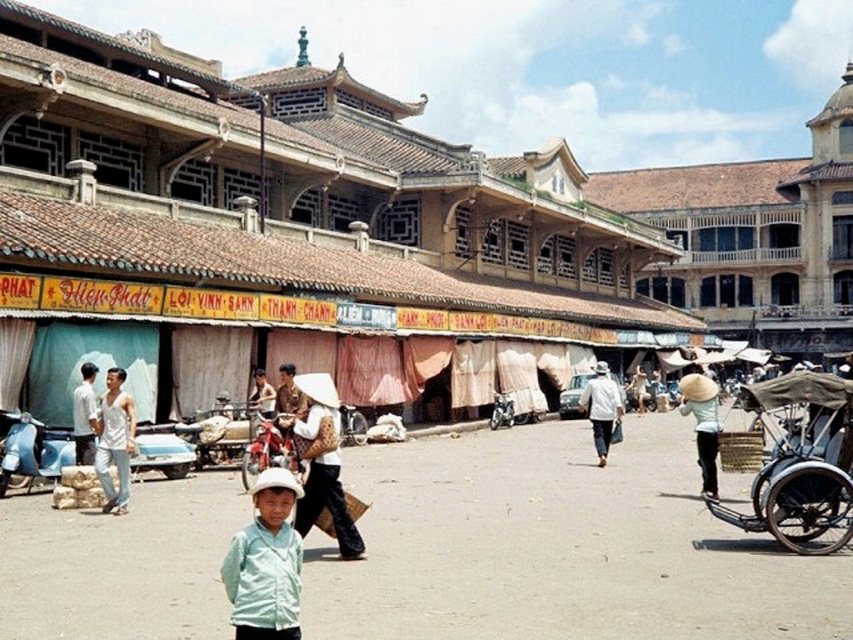
You are a vendor at this market and need to decide which item to place on a narrow shelf that can only hold items thinner than 10 cm. You have the white cotton tank top at left and the light beige straw hat at center. Which item should you choose?

The white cotton tank top at left is thinner than the light beige straw hat at center, so it should be placed on the narrow shelf since it meets the thickness requirement.

You are a tourist standing at the entrance of the market and want to buy a souvenir. You see a wooden cart at right and a light brown woven hat at center. Which object is closer to you?

The wooden cart at right is closer to you because it is positioned below the light brown woven hat at center, indicating it is in a lower level or closer to the viewer.

From the picture: You are a customer in this market and you want to pick up the white cotton tank top at left and the light beige straw hat at center. If you are standing at the entrance, which item would you reach first if you walk straight ahead?

The white cotton tank top at left is closer to the entrance than the light beige straw hat at center, so you would reach it first.